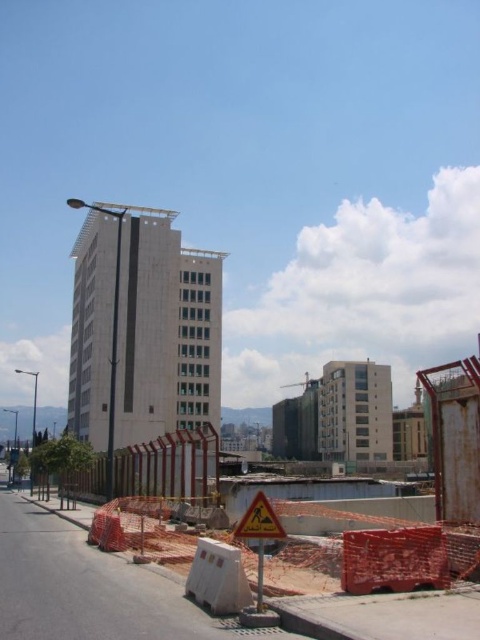
Between white smooth building at center and yellow reflective triangle at center, which one is positioned higher?

white smooth building at center is above.

Does point (122, 404) come in front of point (267, 516)?

No, (122, 404) is further to viewer.

Identify the location of white smooth building at center. The image size is (480, 640). 143,328.

Is white smooth building at center bigger than orange mesh fence at center?

Yes, white smooth building at center is bigger than orange mesh fence at center.

Is point (128, 259) more distant than point (468, 614)?

Yes, it is.

The width and height of the screenshot is (480, 640). I want to click on white smooth building at center, so click(x=143, y=328).

Is orange mesh fence at center smaller than yellow reflective triangle at center?

No.

Does orange mesh fence at center appear over yellow reflective triangle at center?

No.

Is point (92, 630) less distant than point (276, 528)?

Yes, it is in front of point (276, 528).

Where is `orange mesh fence at center`? This screenshot has height=640, width=480. orange mesh fence at center is located at coordinates (179, 595).